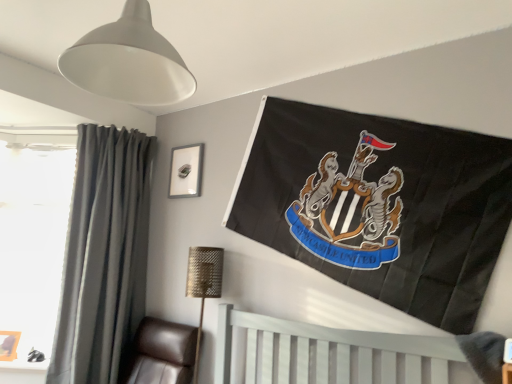
This screenshot has width=512, height=384. Describe the element at coordinates (9, 345) in the screenshot. I see `wooden picture frame at lower left, which ranks as the second picture frame in right-to-left order` at that location.

This screenshot has height=384, width=512. What are the coordinates of `transparent glass window at left` in the screenshot? It's located at (33, 243).

Locate an element on the screen. This screenshot has height=384, width=512. white matte lampshade at upper left, the 2th lamp positioned from the back is located at coordinates (129, 61).

Find the location of a particular element. wooden picture frame at lower left, positioned as the 1th picture frame in bottom-to-top order is located at coordinates (9, 345).

Do you think wooden picture frame at lower left, the second picture frame positioned from the top, is within dark gray fabric curtain at left, or outside of it?

wooden picture frame at lower left, the second picture frame positioned from the top, is outside dark gray fabric curtain at left.

From a real-world perspective, between wooden picture frame at lower left, positioned as the 1th picture frame in bottom-to-top order, and dark gray fabric curtain at left, who is vertically higher?

dark gray fabric curtain at left is physically above.

Based on the photo, is wooden picture frame at lower left, which ranks as the second picture frame in right-to-left order, not near dark gray fabric curtain at left?

No.

Is dark gray fabric curtain at left at the back of wooden picture frame at lower left, positioned as the 1th picture frame in bottom-to-top order?

That's not correct — wooden picture frame at lower left, positioned as the 1th picture frame in bottom-to-top order, is not looking away from dark gray fabric curtain at left.

Could you tell me if wooden picture frame at lower left, marked as the 2th picture frame in a back-to-front arrangement, is turned towards transparent glass window at left?

Yes, wooden picture frame at lower left, marked as the 2th picture frame in a back-to-front arrangement, is aimed at transparent glass window at left.

Is point (16, 357) positioned behind point (8, 156)?

No.

Is wooden picture frame at lower left, which ranks as the second picture frame in right-to-left order, surrounding transparent glass window at left?

No, transparent glass window at left is located outside of wooden picture frame at lower left, which ranks as the second picture frame in right-to-left order.

Between wooden picture frame at lower left, which ranks as the second picture frame in right-to-left order, and transparent glass window at left, which one has larger size?

transparent glass window at left is bigger.

The height and width of the screenshot is (384, 512). In order to click on picture frame on the right of dark gray fabric curtain at left in this screenshot , I will do `click(186, 171)`.

Considering the positions of objects metallic silver picture frame at upper center, which is counted as the second picture frame, starting from the bottom, and dark gray fabric curtain at left in the image provided, who is behind, metallic silver picture frame at upper center, which is counted as the second picture frame, starting from the bottom, or dark gray fabric curtain at left?

metallic silver picture frame at upper center, which is counted as the second picture frame, starting from the bottom, is behind.

Between point (170, 168) and point (124, 253), which one is positioned in front?

Point (124, 253)

From their relative heights in the image, would you say metallic silver picture frame at upper center, which appears as the first picture frame when viewed from the back, is taller or shorter than white matte lampshade at upper left, the 1th lamp viewed from the front?

In the image, metallic silver picture frame at upper center, which appears as the first picture frame when viewed from the back, appears to be shorter than white matte lampshade at upper left, the 1th lamp viewed from the front.

Which point is more forward, [180,175] or [86,80]?

The point [86,80] is closer.

Does metallic silver picture frame at upper center, which is counted as the second picture frame, starting from the bottom, have a smaller size compared to white matte lampshade at upper left, which is the first lamp in top-to-bottom order?

Indeed, metallic silver picture frame at upper center, which is counted as the second picture frame, starting from the bottom, has a smaller size compared to white matte lampshade at upper left, which is the first lamp in top-to-bottom order.

From the image's perspective, is dark gray fabric curtain at left located beneath transparent glass window at left?

Indeed, from the image's perspective, dark gray fabric curtain at left is shown beneath transparent glass window at left.

Looking at this image, is dark gray fabric curtain at left far from transparent glass window at left?

No, dark gray fabric curtain at left is in close proximity to transparent glass window at left.

Is dark gray fabric curtain at left located outside transparent glass window at left?

dark gray fabric curtain at left lies outside transparent glass window at left's area.

Is dark gray fabric curtain at left shorter than transparent glass window at left?

No, dark gray fabric curtain at left is not shorter than transparent glass window at left.

Would you say metallic silver picture frame at upper center, arranged as the 1th picture frame when viewed from the top, is to the left or to the right of wooden picture frame at lower left, which ranks as the second picture frame in right-to-left order, in the picture?

metallic silver picture frame at upper center, arranged as the 1th picture frame when viewed from the top, is to the right of wooden picture frame at lower left, which ranks as the second picture frame in right-to-left order.

From a real-world perspective, is metallic silver picture frame at upper center, arranged as the 1th picture frame when viewed from the top, over wooden picture frame at lower left, positioned as the 1th picture frame in bottom-to-top order?

Yes.

Looking at this image, between metallic silver picture frame at upper center, arranged as the 1th picture frame when viewed from the top, and wooden picture frame at lower left, marked as the first picture frame in a front-to-back arrangement, which one has more height?

Standing taller between the two is metallic silver picture frame at upper center, arranged as the 1th picture frame when viewed from the top.

From a real-world perspective, is transparent glass window at left below gold textured lamp at lower center, which is the 1th lamp from bottom to top?

No.

Who is bigger, transparent glass window at left or gold textured lamp at lower center, which is the second lamp in top-to-bottom order?

transparent glass window at left is bigger.

Is transparent glass window at left not inside gold textured lamp at lower center, which ranks as the 2th lamp in front-to-back order?

Yes.

Is transparent glass window at left facing away from gold textured lamp at lower center, which ranks as the 1th lamp in back-to-front order?

No.

This screenshot has width=512, height=384. Identify the location of the 1st picture frame behind the dark gray fabric curtain at left, starting your count from the anchor. (9, 345).

Where is `window screen above the wooden picture frame at lower left, which appears as the 1th picture frame when viewed from the left (from a real-world perspective)`? The image size is (512, 384). window screen above the wooden picture frame at lower left, which appears as the 1th picture frame when viewed from the left (from a real-world perspective) is located at coordinates (33, 243).

From the image, which object appears to be farther from metallic silver picture frame at upper center, which is the second picture frame in front-to-back order, white matte lampshade at upper left, which is the first lamp in top-to-bottom order, or dark gray fabric curtain at left?

white matte lampshade at upper left, which is the first lamp in top-to-bottom order, is further to metallic silver picture frame at upper center, which is the second picture frame in front-to-back order.

When comparing their distances from metallic silver picture frame at upper center, which is the second picture frame in front-to-back order, does transparent glass window at left or white matte lampshade at upper left, the 1th lamp viewed from the front, seem closer?

The object closer to metallic silver picture frame at upper center, which is the second picture frame in front-to-back order, is transparent glass window at left.

Based on their spatial positions, is dark gray fabric curtain at left or white matte lampshade at upper left, which ranks as the second lamp in bottom-to-top order, further from metallic silver picture frame at upper center, which is the second picture frame in front-to-back order?

white matte lampshade at upper left, which ranks as the second lamp in bottom-to-top order, is positioned further to the anchor metallic silver picture frame at upper center, which is the second picture frame in front-to-back order.

Looking at the image, which one is located closer to gold textured lamp at lower center, which is the second lamp in top-to-bottom order, metallic silver picture frame at upper center, acting as the first picture frame starting from the right, or transparent glass window at left?

metallic silver picture frame at upper center, acting as the first picture frame starting from the right.

Estimate the real-world distances between objects in this image. Which object is further from gold textured lamp at lower center, which is the 1th lamp from bottom to top, wooden picture frame at lower left, marked as the 2th picture frame in a back-to-front arrangement, or transparent glass window at left?

wooden picture frame at lower left, marked as the 2th picture frame in a back-to-front arrangement, lies further to gold textured lamp at lower center, which is the 1th lamp from bottom to top, than the other object.

When comparing their distances from metallic silver picture frame at upper center, which appears as the first picture frame when viewed from the back, does dark gray fabric curtain at left or gold textured lamp at lower center, which ranks as the 1th lamp in back-to-front order, seem further?

gold textured lamp at lower center, which ranks as the 1th lamp in back-to-front order.

Based on their spatial positions, is gold textured lamp at lower center, which is the second lamp in top-to-bottom order, or transparent glass window at left closer to metallic silver picture frame at upper center, acting as the first picture frame starting from the right?

gold textured lamp at lower center, which is the second lamp in top-to-bottom order, lies closer to metallic silver picture frame at upper center, acting as the first picture frame starting from the right, than the other object.

Estimate the real-world distances between objects in this image. Which object is closer to white painted wood bed at lower center, wooden picture frame at lower left, which ranks as the second picture frame in right-to-left order, or gold textured lamp at lower center, which ranks as the 2th lamp in front-to-back order?

Based on the image, gold textured lamp at lower center, which ranks as the 2th lamp in front-to-back order, appears to be nearer to white painted wood bed at lower center.

Find the location of `curtain located between wooden picture frame at lower left, marked as the 2th picture frame in a back-to-front arrangement, and gold textured lamp at lower center, which is the second lamp in top-to-bottom order, in the left-right direction`. curtain located between wooden picture frame at lower left, marked as the 2th picture frame in a back-to-front arrangement, and gold textured lamp at lower center, which is the second lamp in top-to-bottom order, in the left-right direction is located at coordinates (104, 255).

Identify the location of lamp between white matte lampshade at upper left, the 2th lamp positioned from the back, and transparent glass window at left from front to back. (203, 284).

This screenshot has width=512, height=384. What are the coordinates of `lamp between white matte lampshade at upper left, the 1th lamp viewed from the front, and wooden picture frame at lower left, marked as the 2th picture frame in a back-to-front arrangement, along the z-axis` in the screenshot? It's located at (203, 284).

Identify the location of picture frame located between white matte lampshade at upper left, the 2th lamp positioned from the back, and metallic silver picture frame at upper center, acting as the first picture frame starting from the right, in the depth direction. This screenshot has width=512, height=384. (9, 345).